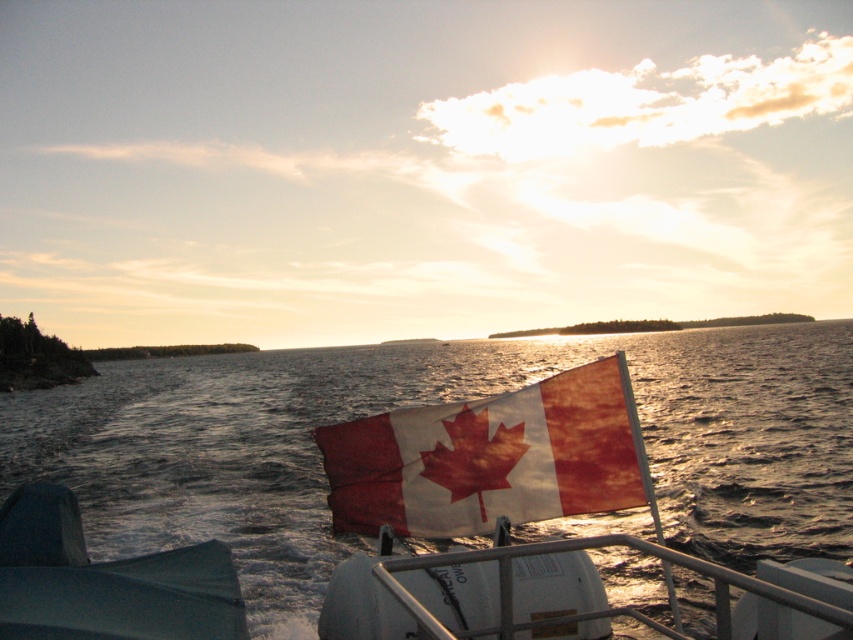
Looking at this image, which is below, translucent water at center or worn fabric flag at center?

translucent water at center is lower down.

What do you see at coordinates (433, 403) in the screenshot? I see `translucent water at center` at bounding box center [433, 403].

This screenshot has width=853, height=640. I want to click on translucent water at center, so click(x=433, y=403).